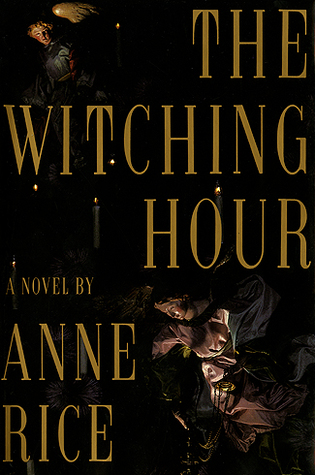
Find the location of a particular element. The image size is (315, 475). candles is located at coordinates (97, 221), (219, 200).